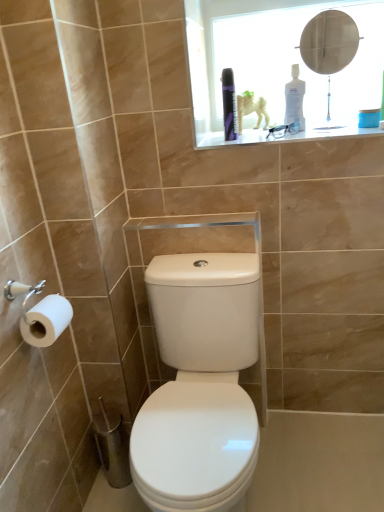
Question: Can you confirm if metallic round mirror at upper center is taller than white plastic bottle at upper center, positioned as the first toiletry in right-to-left order?

Choices:
 (A) no
 (B) yes

Answer: (B)

Question: Does metallic round mirror at upper center have a lesser width compared to white plastic bottle at upper center, positioned as the first toiletry in right-to-left order?

Choices:
 (A) no
 (B) yes

Answer: (A)

Question: Does metallic round mirror at upper center have a greater width compared to white plastic bottle at upper center, the second toiletry when ordered from left to right?

Choices:
 (A) no
 (B) yes

Answer: (B)

Question: Is white plastic bottle at upper center, positioned as the first toiletry in right-to-left order, a part of metallic round mirror at upper center?

Choices:
 (A) no
 (B) yes

Answer: (B)

Question: From a real-world perspective, is metallic round mirror at upper center on white plastic bottle at upper center, the second toiletry when ordered from left to right?

Choices:
 (A) no
 (B) yes

Answer: (B)

Question: Can we say metallic round mirror at upper center lies outside white plastic bottle at upper center, positioned as the first toiletry in right-to-left order?

Choices:
 (A) yes
 (B) no

Answer: (A)

Question: Is transparent plastic medicine cabinet at upper center surrounding purple glossy can at upper center, which appears as the 2th toiletry when viewed from the right?

Choices:
 (A) yes
 (B) no

Answer: (B)

Question: Is transparent plastic medicine cabinet at upper center looking in the opposite direction of purple glossy can at upper center, which is the first toiletry from left to right?

Choices:
 (A) no
 (B) yes

Answer: (A)

Question: Does transparent plastic medicine cabinet at upper center have a smaller size compared to purple glossy can at upper center, which is the first toiletry from left to right?

Choices:
 (A) yes
 (B) no

Answer: (B)

Question: Is transparent plastic medicine cabinet at upper center positioned beyond the bounds of purple glossy can at upper center, which appears as the 2th toiletry when viewed from the right?

Choices:
 (A) no
 (B) yes

Answer: (B)

Question: Does transparent plastic medicine cabinet at upper center have a larger size compared to purple glossy can at upper center, which appears as the 2th toiletry when viewed from the right?

Choices:
 (A) yes
 (B) no

Answer: (A)

Question: Is transparent plastic medicine cabinet at upper center far from purple glossy can at upper center, which is the first toiletry from left to right?

Choices:
 (A) yes
 (B) no

Answer: (B)

Question: Does white matte toilet paper at left have a larger size compared to purple glossy can at upper center, which is the first toiletry from left to right?

Choices:
 (A) yes
 (B) no

Answer: (A)